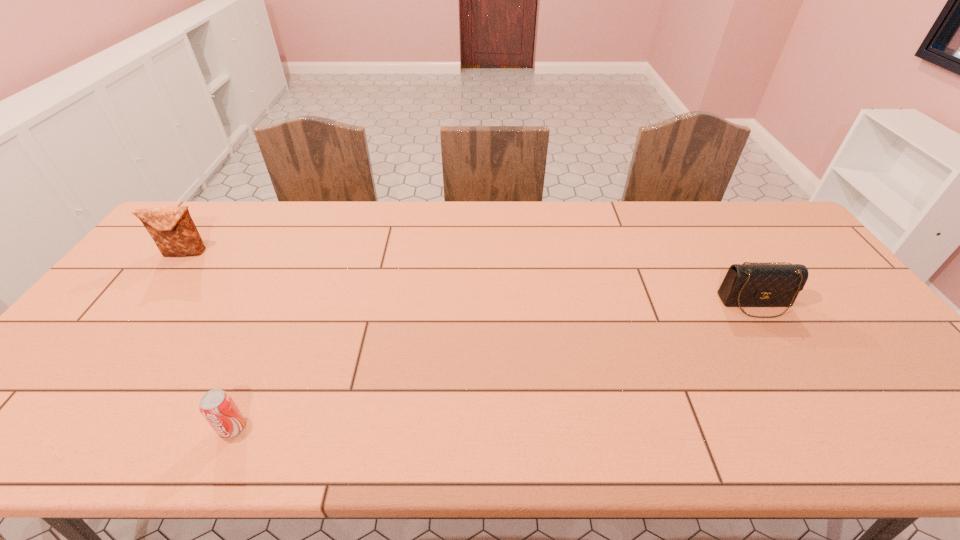
Identify the location of vacant space that's between the second object from right to left and the tallest object. Image resolution: width=960 pixels, height=540 pixels. (209, 340).

Locate an element on the screen. The image size is (960, 540). unoccupied position between the left clutch bag and the right clutch bag is located at coordinates (470, 278).

The image size is (960, 540). Find the location of `vacant space that's between the nearest object and the shorter clutch bag`. vacant space that's between the nearest object and the shorter clutch bag is located at coordinates (494, 365).

Image resolution: width=960 pixels, height=540 pixels. Find the location of `free spot between the rightmost object and the tallest object`. free spot between the rightmost object and the tallest object is located at coordinates (470, 278).

Image resolution: width=960 pixels, height=540 pixels. What are the coordinates of `vacant space in between the shorter clutch bag and the soda can` in the screenshot? It's located at (494, 365).

This screenshot has height=540, width=960. In order to click on the closest object relative to the leftmost object in this screenshot , I will do `click(217, 407)`.

Locate an element on the screen. The width and height of the screenshot is (960, 540). object that is the closest to the leftmost object is located at coordinates (217, 407).